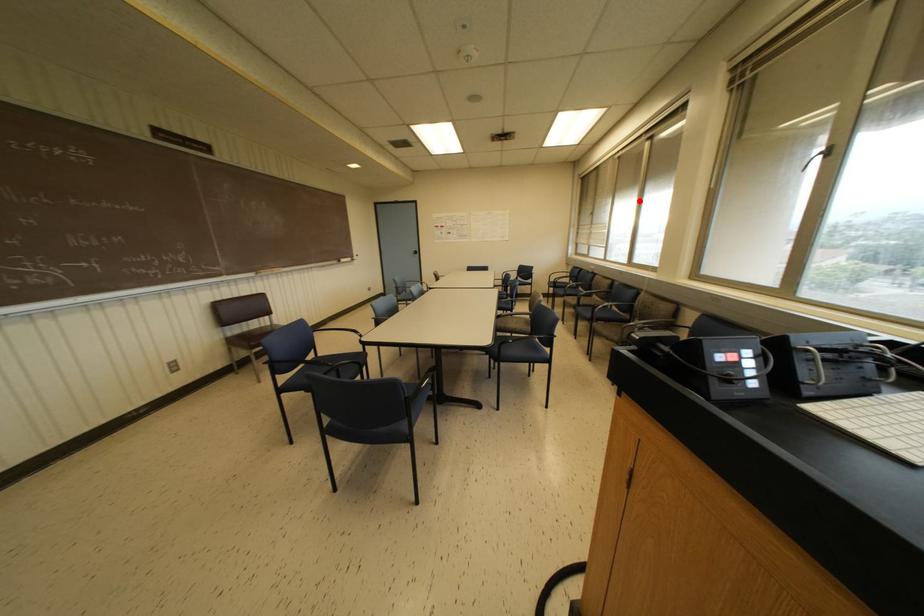
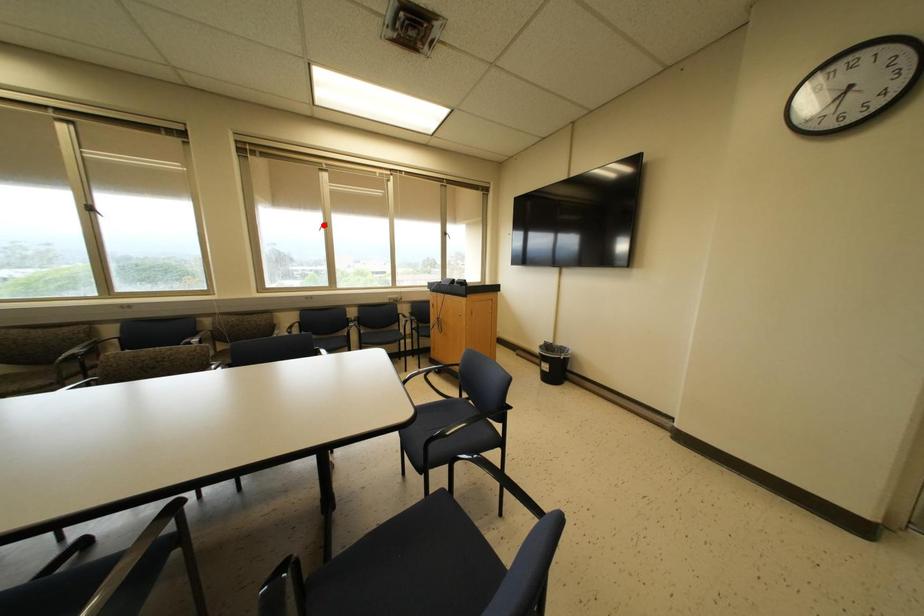
I am providing you with two images of the same scene from different viewpoints. A red point is marked on the first image and another point is marked on the second image. Are the points marked in image1 and image2 representing the same 3D position?

No